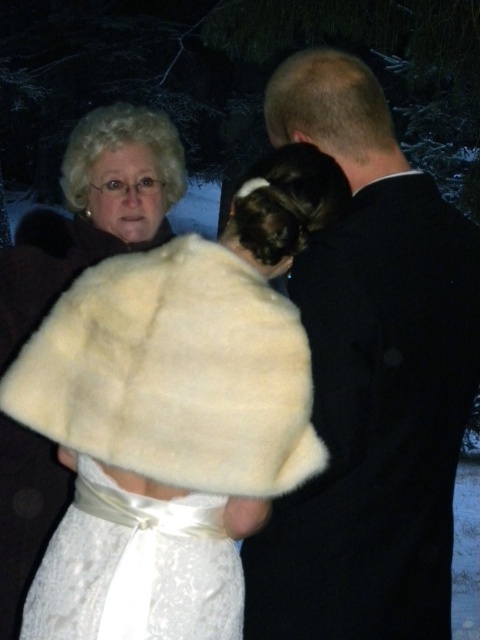
Question: Is white fur shawl at upper left positioned at the back of white satin dress at center?

Choices:
 (A) yes
 (B) no

Answer: (B)

Question: Which object is closer to the camera taking this photo?

Choices:
 (A) black satin suit at center
 (B) white fur shawl at upper left

Answer: (B)

Question: Which of the following is the closest to the observer?

Choices:
 (A) white satin dress at center
 (B) black satin suit at center

Answer: (A)

Question: Which point is farther to the camera?

Choices:
 (A) (188, 458)
 (B) (130, 573)
 (C) (435, 620)

Answer: (C)

Question: Is black satin suit at center smaller than white fur shawl at upper left?

Choices:
 (A) no
 (B) yes

Answer: (A)

Question: Is the position of black satin suit at center less distant than that of white fur shawl at upper left?

Choices:
 (A) no
 (B) yes

Answer: (A)